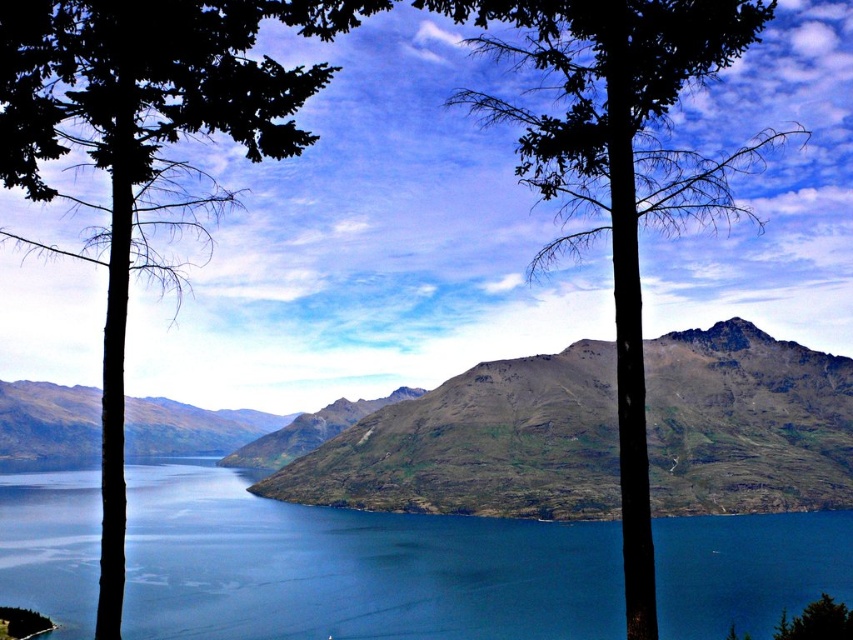
Question: Among these points, which one is farthest from the camera?

Choices:
 (A) (679, 417)
 (B) (714, 524)

Answer: (A)

Question: Can you confirm if blue water at center is smaller than green leafy tree at center?

Choices:
 (A) no
 (B) yes

Answer: (B)

Question: Which of these objects is positioned closest to the dark green leafy tree at left?

Choices:
 (A) green leafy tree at center
 (B) rugged rock mountain at center

Answer: (A)

Question: Is blue water at center above green leafy tree at center?

Choices:
 (A) yes
 (B) no

Answer: (B)

Question: Considering the real-world distances, which object is closest to the blue water at center?

Choices:
 (A) green leafy tree at center
 (B) dark green leafy tree at left
 (C) rugged rock mountain at center

Answer: (C)

Question: Is blue water at center closer to the viewer compared to rugged rock mountain at center?

Choices:
 (A) no
 (B) yes

Answer: (B)